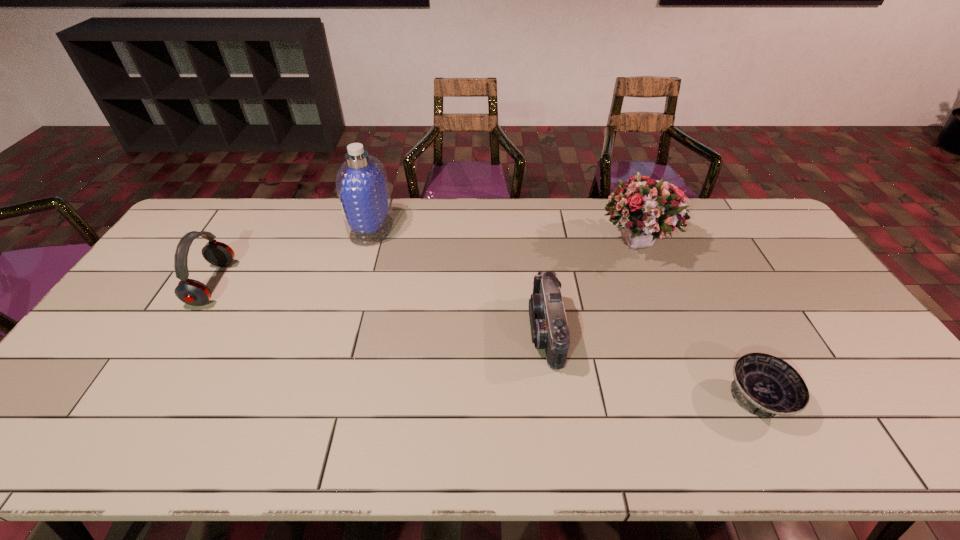
Find the location of a particular element. vacant area located on the ear cups of the earphone is located at coordinates (286, 284).

Image resolution: width=960 pixels, height=540 pixels. I want to click on free space located 0.400m on the front-facing side of the third object from left to right, so click(384, 331).

This screenshot has width=960, height=540. Find the location of `free spot located on the front-facing side of the third object from left to right`. free spot located on the front-facing side of the third object from left to right is located at coordinates (471, 331).

This screenshot has width=960, height=540. I want to click on vacant region located on the front-facing side of the third object from left to right, so click(423, 331).

You are a GUI agent. You are given a task and a screenshot of the screen. Output one action in this format:
    pyautogui.click(x=<x>, y=<y>)
    Task: Click on the vacant space located on the back of the bowl
    The height and width of the screenshot is (540, 960).
    Given the screenshot: What is the action you would take?
    pyautogui.click(x=728, y=340)

This screenshot has height=540, width=960. What are the coordinates of `cleansing agent positioned at the far edge` in the screenshot? It's located at (362, 187).

Locate an element on the screen. Image resolution: width=960 pixels, height=540 pixels. bouquet that is at the far edge is located at coordinates (646, 209).

Locate an element on the screen. This screenshot has height=540, width=960. object that is positioned at the near edge is located at coordinates (764, 385).

In the image, there is a desktop. Where is `vacant region at the far edge`? The height and width of the screenshot is (540, 960). vacant region at the far edge is located at coordinates (605, 224).

In order to click on free region at the near edge of the desktop in this screenshot , I will do `click(684, 422)`.